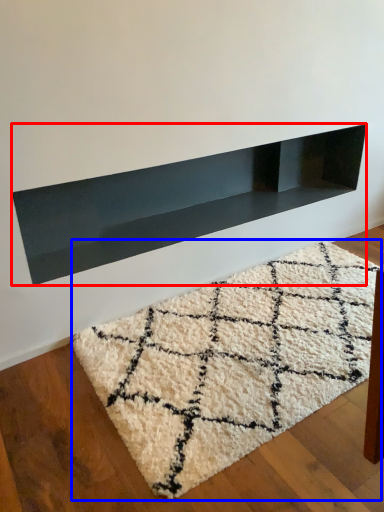
Question: Which point is closer to the camera, shelf (highlighted by a red box) or mat (highlighted by a blue box)?

Choices:
 (A) shelf
 (B) mat

Answer: (B)